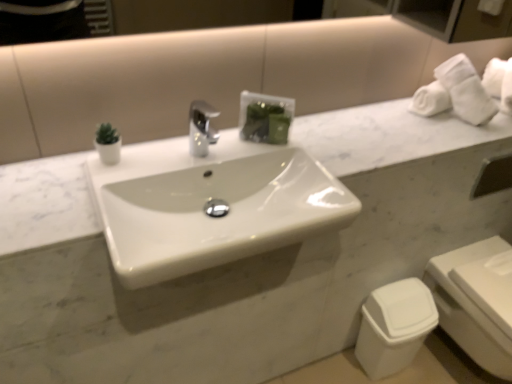
Question: Considering their positions, is white plastic toilet at lower right located in front of or behind white plastic toilet bowl at lower right?

Choices:
 (A) behind
 (B) front

Answer: (B)

Question: In terms of width, does white plastic toilet at lower right look wider or thinner when compared to white plastic toilet bowl at lower right?

Choices:
 (A) thin
 (B) wide

Answer: (B)

Question: Which of these objects is positioned closest to the white plastic toilet at lower right?

Choices:
 (A) white glossy sink at center
 (B) white plastic toilet bowl at lower right

Answer: (B)

Question: Estimate the real-world distances between objects in this image. Which object is farther from the white glossy sink at center?

Choices:
 (A) white plastic toilet bowl at lower right
 (B) white plastic toilet at lower right

Answer: (B)